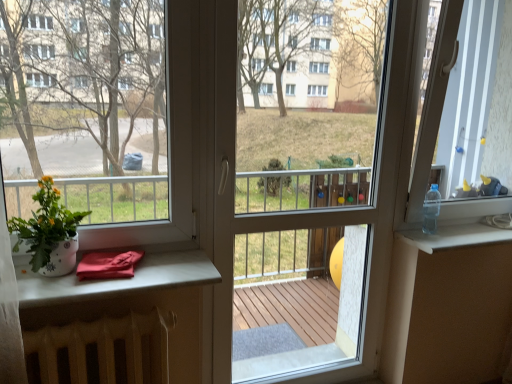
Identify the location of empty space that is ontop of matte white table at lower left, which is the second table from bottom to top (from a real-world perspective). (106, 276).